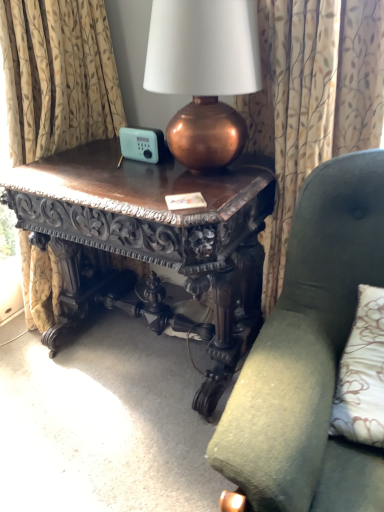
Question: Should I look upward or downward to see patterned fabric curtain at upper center?

Choices:
 (A) up
 (B) down

Answer: (A)

Question: Is the depth of polished dark wood table at center greater than that of green fabric chair at center?

Choices:
 (A) yes
 (B) no

Answer: (A)

Question: Is polished dark wood table at center taller than green fabric chair at center?

Choices:
 (A) no
 (B) yes

Answer: (A)

Question: Would you say polished dark wood table at center contains green fabric chair at center?

Choices:
 (A) yes
 (B) no

Answer: (B)

Question: Is polished dark wood table at center oriented away from green fabric chair at center?

Choices:
 (A) no
 (B) yes

Answer: (A)

Question: From the image's perspective, does polished dark wood table at center appear lower than green fabric chair at center?

Choices:
 (A) yes
 (B) no

Answer: (B)

Question: From a real-world perspective, is polished dark wood table at center below green fabric chair at center?

Choices:
 (A) yes
 (B) no

Answer: (A)

Question: Is green fabric chair at center facing towards polished dark wood table at center?

Choices:
 (A) no
 (B) yes

Answer: (A)

Question: Is green fabric chair at center next to polished dark wood table at center?

Choices:
 (A) yes
 (B) no

Answer: (B)

Question: Is green fabric chair at center not inside polished dark wood table at center?

Choices:
 (A) yes
 (B) no

Answer: (A)

Question: From the image's perspective, does green fabric chair at center appear higher than polished dark wood table at center?

Choices:
 (A) yes
 (B) no

Answer: (B)

Question: Is green fabric chair at center positioned far away from polished dark wood table at center?

Choices:
 (A) yes
 (B) no

Answer: (B)

Question: Is polished dark wood table at center surrounded by green fabric chair at center?

Choices:
 (A) no
 (B) yes

Answer: (A)

Question: Is patterned fabric curtain at upper center smaller than polished dark wood table at center?

Choices:
 (A) no
 (B) yes

Answer: (B)